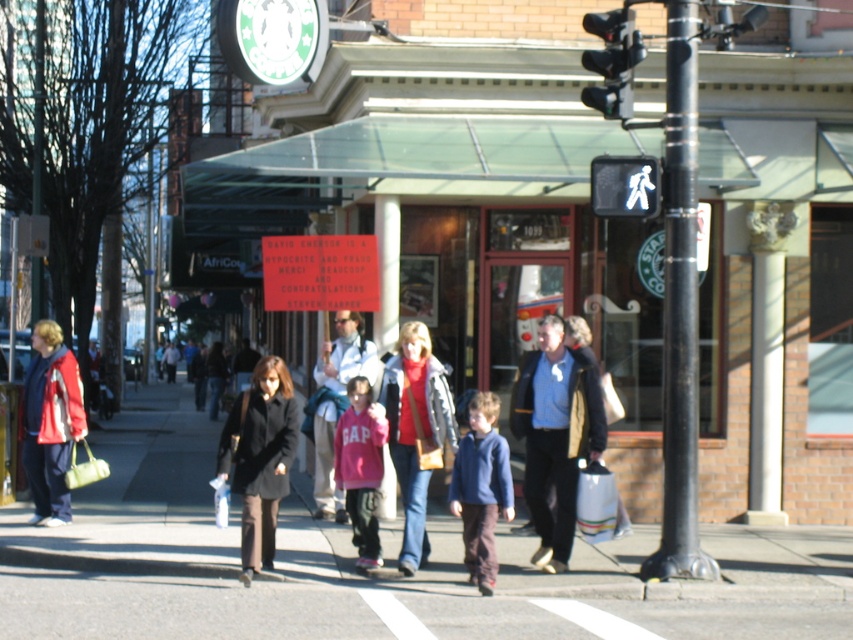
Question: Which object is positioned farthest from the black metal pole at center?

Choices:
 (A) green matte sign at upper center
 (B) pink fleece jacket at center
 (C) blue denim jacket at center
 (D) white plastic bag at lower center

Answer: (A)

Question: Can you confirm if blue fleece jacket at center is thinner than pink fabric jacket at center?

Choices:
 (A) no
 (B) yes

Answer: (B)

Question: Which object appears closest to the camera in this image?

Choices:
 (A) smooth asphalt at center
 (B) pink fabric jacket at center
 (C) green matte sign at upper center

Answer: (A)

Question: Can you confirm if matte red jacket at center is smaller than matte red jacket at left?

Choices:
 (A) no
 (B) yes

Answer: (B)

Question: Can you confirm if blue denim jacket at center is positioned below dark brown wool coat at center?

Choices:
 (A) no
 (B) yes

Answer: (A)

Question: Among these points, which one is farthest from the camera?

Choices:
 (A) (448, 502)
 (B) (442, 412)
 (C) (560, 563)

Answer: (A)